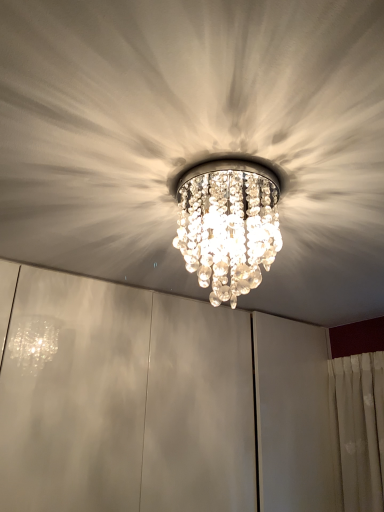
Question: Is clear crystal chandelier at center with clear crystal chandelier at center?

Choices:
 (A) yes
 (B) no

Answer: (B)

Question: Considering the relative positions of clear crystal chandelier at center and clear crystal chandelier at center in the image provided, is clear crystal chandelier at center in front of clear crystal chandelier at center?

Choices:
 (A) yes
 (B) no

Answer: (B)

Question: Is clear crystal chandelier at center to the right of clear crystal chandelier at center from the viewer's perspective?

Choices:
 (A) yes
 (B) no

Answer: (B)

Question: Is clear crystal chandelier at center behind clear crystal chandelier at center?

Choices:
 (A) yes
 (B) no

Answer: (A)

Question: Considering the relative sizes of clear crystal chandelier at center and clear crystal chandelier at center in the image provided, is clear crystal chandelier at center taller than clear crystal chandelier at center?

Choices:
 (A) yes
 (B) no

Answer: (A)

Question: Can you confirm if clear crystal chandelier at center is wider than clear crystal chandelier at center?

Choices:
 (A) no
 (B) yes

Answer: (A)

Question: Does clear crystal chandelier at center turn towards clear crystal chandelier at center?

Choices:
 (A) no
 (B) yes

Answer: (A)

Question: Is clear crystal chandelier at center in contact with clear crystal chandelier at center?

Choices:
 (A) yes
 (B) no

Answer: (B)

Question: Is clear crystal chandelier at center at the left side of clear crystal chandelier at center?

Choices:
 (A) no
 (B) yes

Answer: (A)

Question: Is clear crystal chandelier at center smaller than clear crystal chandelier at center?

Choices:
 (A) no
 (B) yes

Answer: (A)

Question: From a real-world perspective, is clear crystal chandelier at center physically below clear crystal chandelier at center?

Choices:
 (A) yes
 (B) no

Answer: (B)

Question: Is clear crystal chandelier at center positioned before clear crystal chandelier at center?

Choices:
 (A) no
 (B) yes

Answer: (B)

Question: Is clear crystal chandelier at center in front of or behind clear crystal chandelier at center in the image?

Choices:
 (A) front
 (B) behind

Answer: (B)